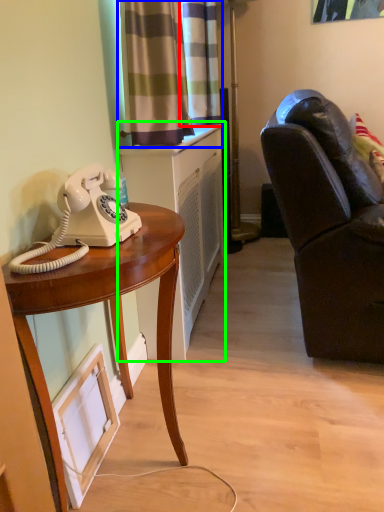
Question: Estimate the real-world distances between objects in this image. Which object is closer to curtain (highlighted by a red box), curtain (highlighted by a blue box) or cabinetry (highlighted by a green box)?

Choices:
 (A) curtain
 (B) cabinetry

Answer: (A)